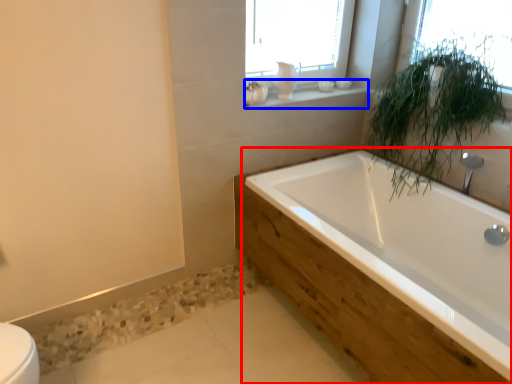
Question: Which object appears farthest to the camera in this image, bathtub (highlighted by a red box) or window sill (highlighted by a blue box)?

Choices:
 (A) bathtub
 (B) window sill

Answer: (B)